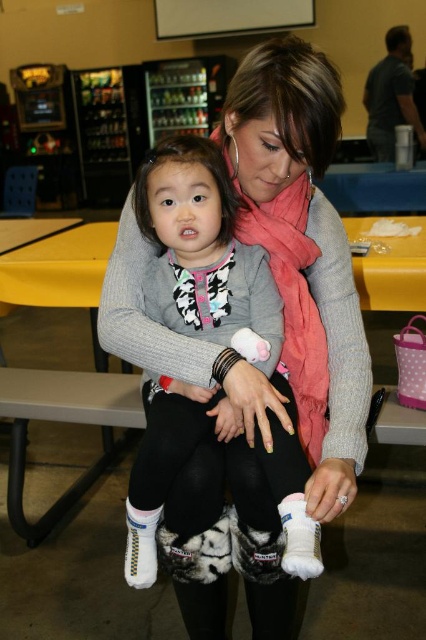
Question: Estimate the real-world distances between objects in this image. Which object is farther from the gray wool sweater at center?

Choices:
 (A) white fluffy sock at lower center
 (B) white fuzzy socks at center
 (C) white knit sock at lower center

Answer: (C)

Question: Does white fuzzy socks at center appear under gray wool sweater at center?

Choices:
 (A) no
 (B) yes

Answer: (A)

Question: Which point is closer to the camera?

Choices:
 (A) white fluffy sock at lower center
 (B) white fuzzy socks at center

Answer: (A)

Question: Does white fuzzy socks at center come behind gray wool sweater at center?

Choices:
 (A) no
 (B) yes

Answer: (B)

Question: Which object is the closest to the white fluffy sock at lower center?

Choices:
 (A) white knit sock at lower center
 (B) gray wool sweater at center

Answer: (B)

Question: Is white fluffy sock at lower center smaller than white knit sock at lower center?

Choices:
 (A) no
 (B) yes

Answer: (A)